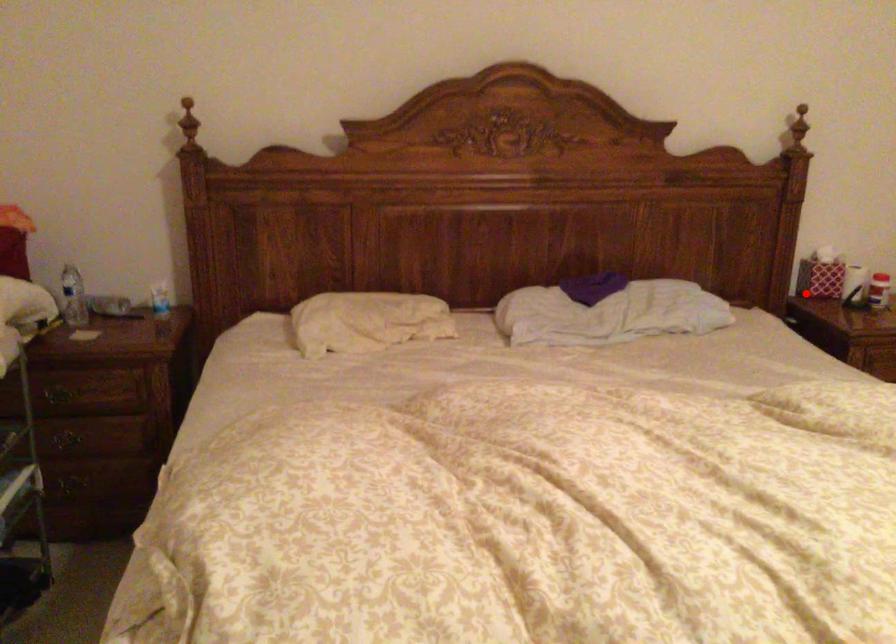
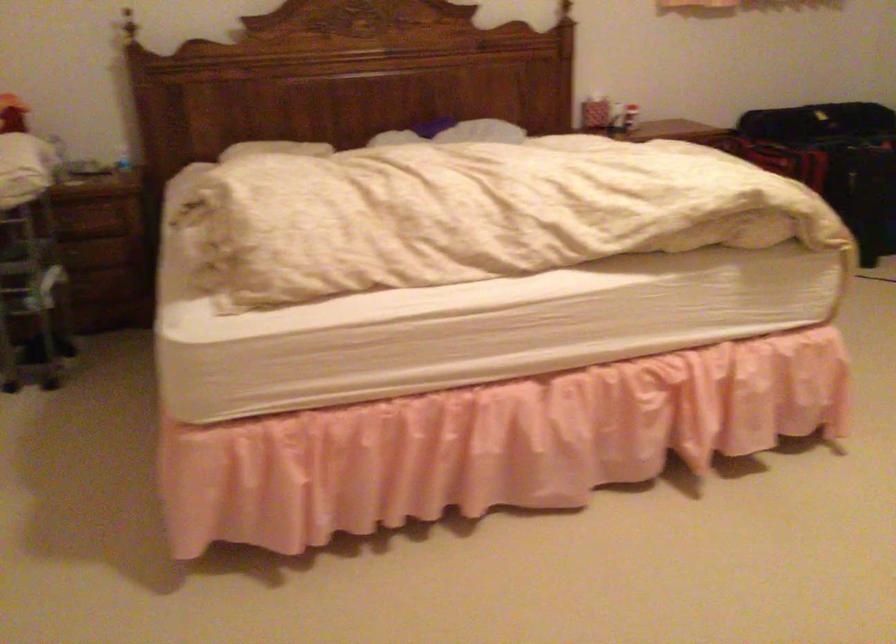
Question: I am providing you with two images of the same scene from different viewpoints. Image1 has a red point marked. In image2, the corresponding 3D location appears at what relative position? Reply with the corresponding letter.

Choices:
 (A) Closer
 (B) Farther

Answer: (B)